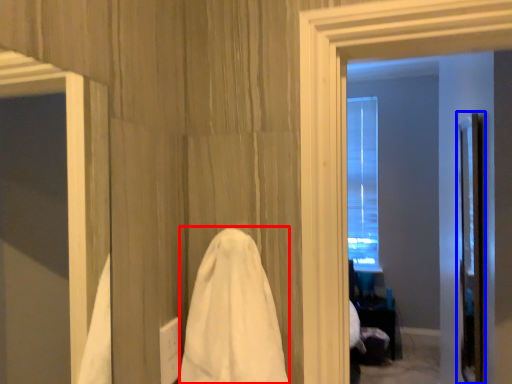
Question: Which of the following is the farthest to the observer, bath towel (highlighted by a red box) or screen door (highlighted by a blue box)?

Choices:
 (A) bath towel
 (B) screen door

Answer: (B)